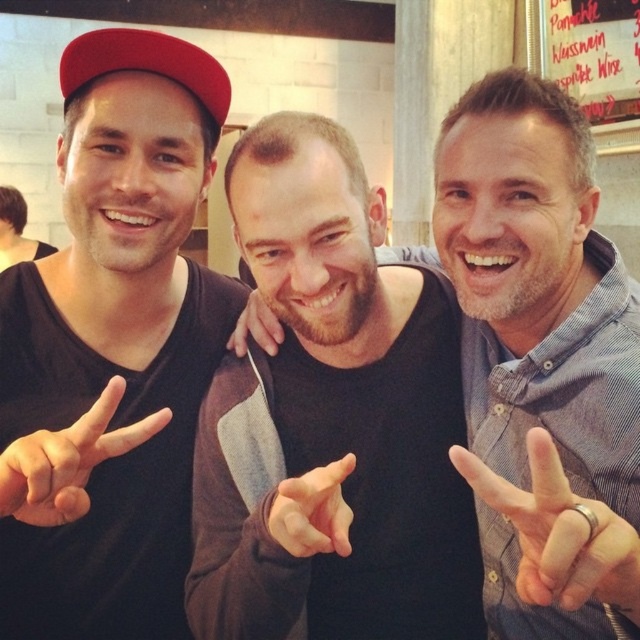
Question: Is black matte shirt at center to the left of black matte hand at center from the viewer's perspective?

Choices:
 (A) yes
 (B) no

Answer: (B)

Question: Is black matte hand at center to the right of smooth skin hand at center from the viewer's perspective?

Choices:
 (A) yes
 (B) no

Answer: (B)

Question: Which object is positioned farthest from the black matte hand at center?

Choices:
 (A) matte red baseball cap at upper left
 (B) smooth skin hand at center

Answer: (A)

Question: Does silver metallic ring at right have a larger size compared to matte red baseball cap at upper left?

Choices:
 (A) yes
 (B) no

Answer: (A)

Question: Based on their relative distances, which object is farther from the matte red baseball cap at upper left?

Choices:
 (A) brown leather hand at center
 (B) matte black shirt at left
 (C) black matte shirt at center
 (D) smooth skin hand at center

Answer: (D)

Question: Which point is farther to the camera?

Choices:
 (A) (74, 65)
 (B) (346, 516)

Answer: (A)